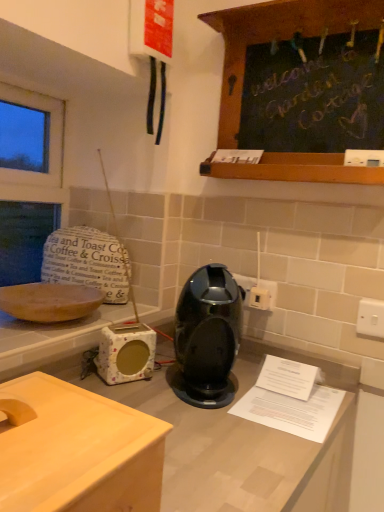
Question: Is point (261, 294) positioned closer to the camera than point (145, 342)?

Choices:
 (A) farther
 (B) closer

Answer: (A)

Question: Is white plastic electric outlet at center-right, arranged as the 2th electric outlet when viewed from the right, bigger or smaller than floral-patterned ceramic toaster at lower left?

Choices:
 (A) small
 (B) big

Answer: (A)

Question: Based on their relative distances, which object is farther from the white plastic electric outlet at center-right, the third electric outlet when ordered from right to left?

Choices:
 (A) black wood chalkboard at upper right
 (B) matte wooden bowl at left
 (C) floral-patterned ceramic toaster at lower left
 (D) glossy plastic coffee machine at center
 (E) white plastic electric outlet at center-right, which appears as the second electric outlet when viewed from the back

Answer: (B)

Question: Based on their relative distances, which object is nearer to the glossy plastic coffee machine at center?

Choices:
 (A) matte wooden countertop at center
 (B) white plastic electric outlet at center-right, arranged as the first electric outlet when viewed from the left
 (C) white plastic switch at right, the first electric outlet when ordered from front to back
 (D) black wood chalkboard at upper right
 (E) white plastic electric outlet at center-right, which appears as the second electric outlet when viewed from the back

Answer: (B)